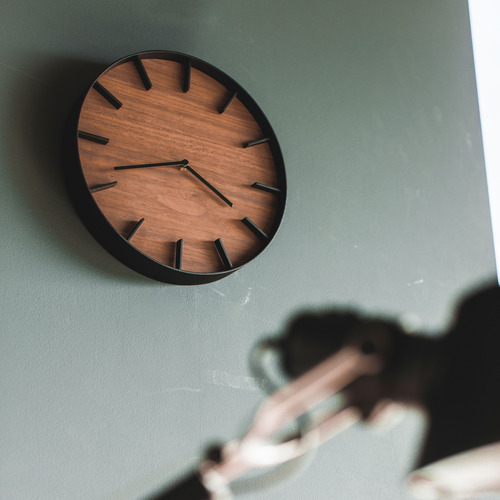
The image size is (500, 500). Find the location of `wooden clock`. wooden clock is located at coordinates (176, 198).